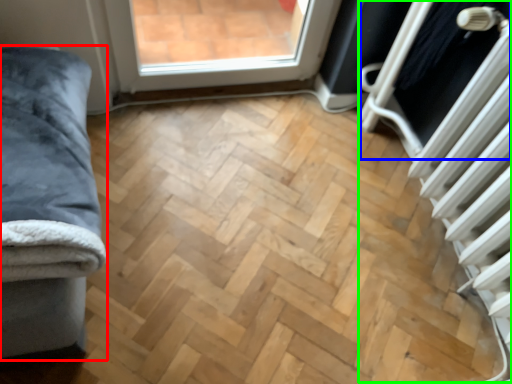
Question: Which object is positioned farthest from furniture (highlighted by a red box)? Select from screen door (highlighted by a blue box) and radiator (highlighted by a green box).

Choices:
 (A) screen door
 (B) radiator

Answer: (A)